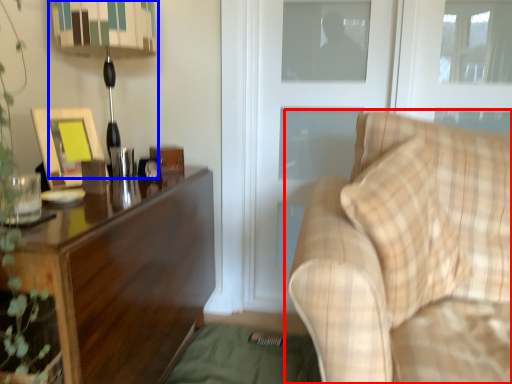
Question: Which object is further to the camera taking this photo, studio couch (highlighted by a red box) or table lamp (highlighted by a blue box)?

Choices:
 (A) studio couch
 (B) table lamp

Answer: (B)